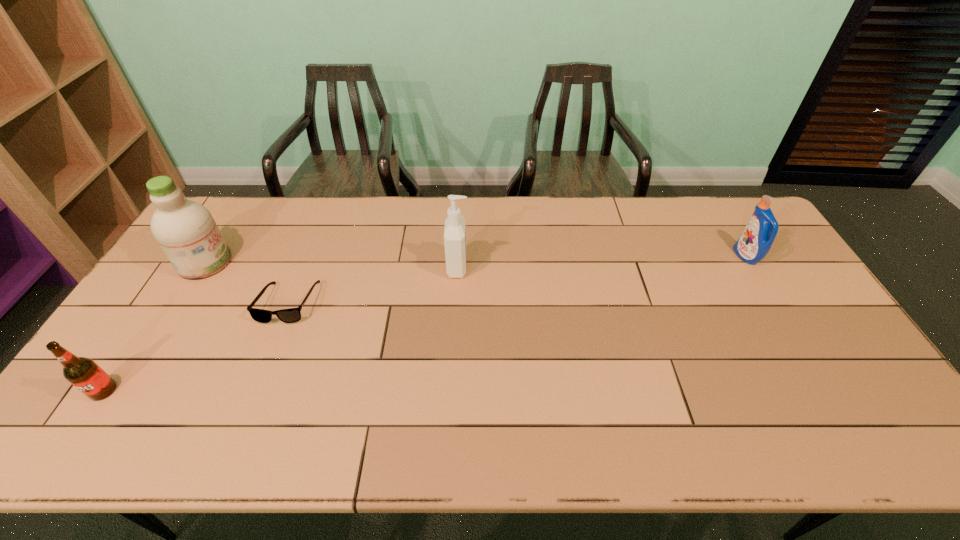
Where is `vacant space located on the label of the detergent`? vacant space located on the label of the detergent is located at coordinates (684, 256).

At what (x,y) coordinates should I click in order to perform the action: click on free space located on the back of the root beer. Please return your answer as a coordinate pair (x, y). Looking at the image, I should click on (131, 350).

This screenshot has width=960, height=540. Find the location of `free space located 0.260m on the front-facing side of the sunglasses`. free space located 0.260m on the front-facing side of the sunglasses is located at coordinates (245, 411).

Where is `cleansing agent that is at the left edge`? The image size is (960, 540). cleansing agent that is at the left edge is located at coordinates (185, 230).

The image size is (960, 540). I want to click on root beer that is at the left edge, so click(82, 372).

Find the location of a particular element. The image size is (960, 540). object present at the right edge is located at coordinates (756, 240).

In the image, there is a desktop. Where is `free region at the far edge`? free region at the far edge is located at coordinates (583, 224).

Locate an element on the screen. Image resolution: width=960 pixels, height=540 pixels. vacant area at the right edge of the desktop is located at coordinates (788, 329).

In the image, there is a desktop. At what (x,y) coordinates should I click in order to perform the action: click on vacant space at the far left corner. Please return your answer as a coordinate pair (x, y). The height and width of the screenshot is (540, 960). Looking at the image, I should click on (249, 219).

The image size is (960, 540). In order to click on vacant area between the left cleansing agent and the shortest object in this screenshot , I will do `click(247, 283)`.